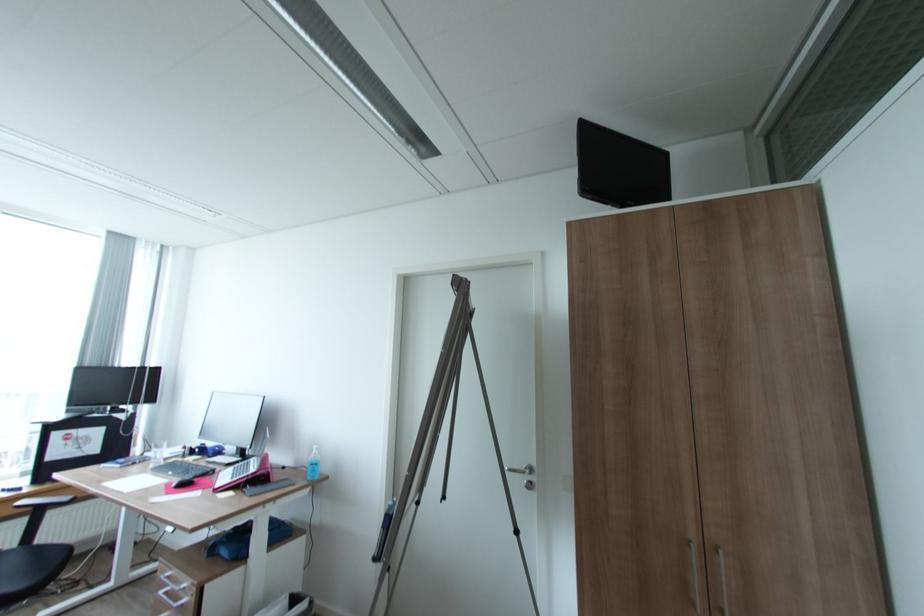
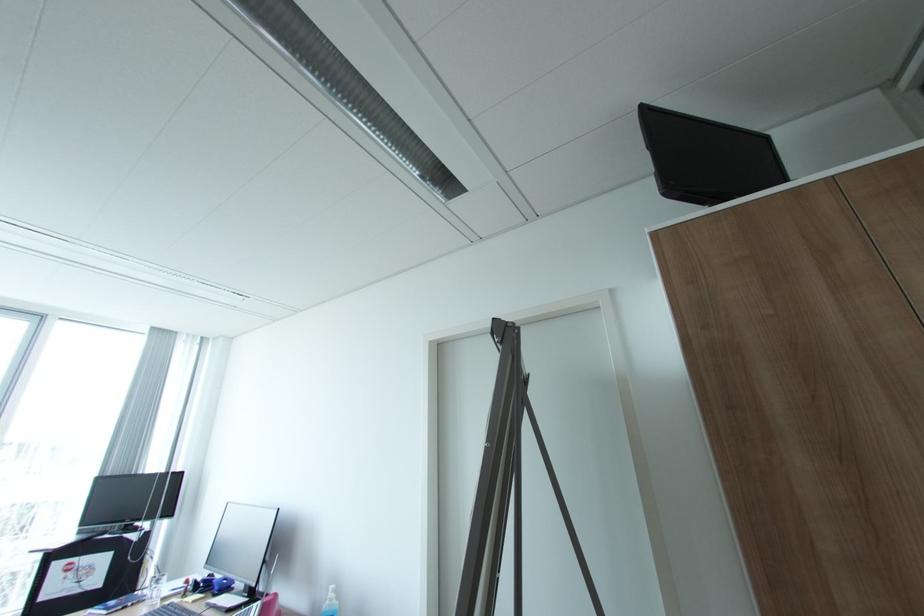
In the second image, find the point that corresponds to pixel 216 453 in the first image.

(222, 588)